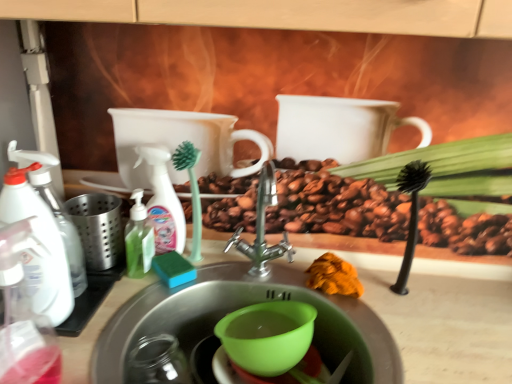
This screenshot has width=512, height=384. I want to click on free spot to the right of green plastic scrub brush at center, the second plant from the right, so click(x=251, y=274).